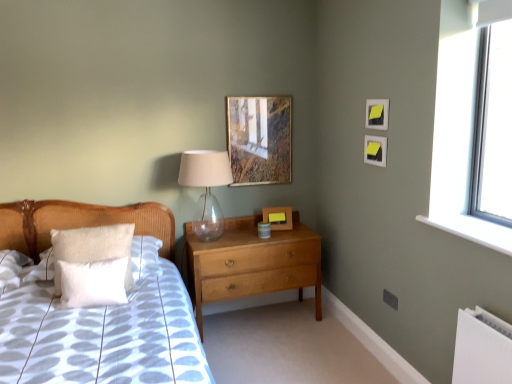
Image resolution: width=512 pixels, height=384 pixels. Find the location of `empty space that is ontop of light brown wood chest of drawers at center`. empty space that is ontop of light brown wood chest of drawers at center is located at coordinates (251, 233).